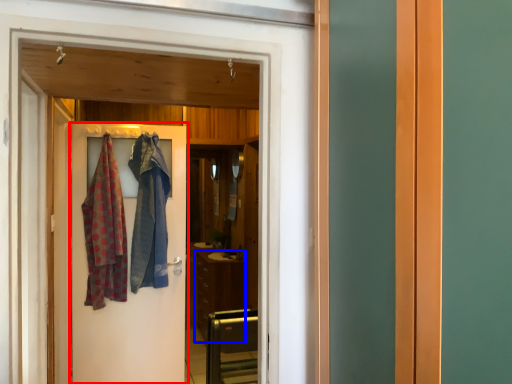
Question: Which of the following is the farthest to the observer, door (highlighted by a red box) or cabinetry (highlighted by a blue box)?

Choices:
 (A) door
 (B) cabinetry

Answer: (B)